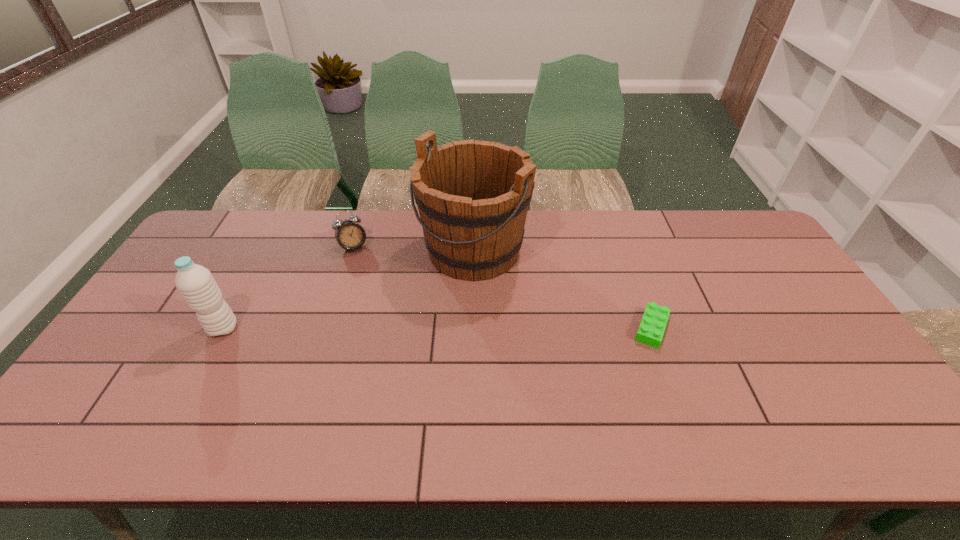
This screenshot has width=960, height=540. Find the location of `free space on the desktop that is between the leftmost object and the Lego and is positioned on the face of the second object from left to right`. free space on the desktop that is between the leftmost object and the Lego and is positioned on the face of the second object from left to right is located at coordinates (393, 328).

Identify the location of free space on the desktop that is between the third shortest object and the rightmost object and is positioned on the side of the second object from right to left with the handle for carrying. The image size is (960, 540). (390, 328).